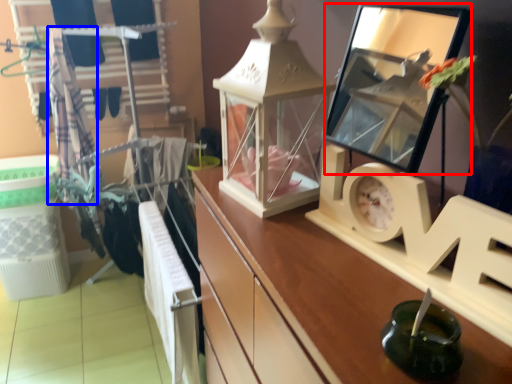
Question: Which object is further to the camera taking this photo, mirror (highlighted by a red box) or clothesline (highlighted by a blue box)?

Choices:
 (A) mirror
 (B) clothesline

Answer: (B)